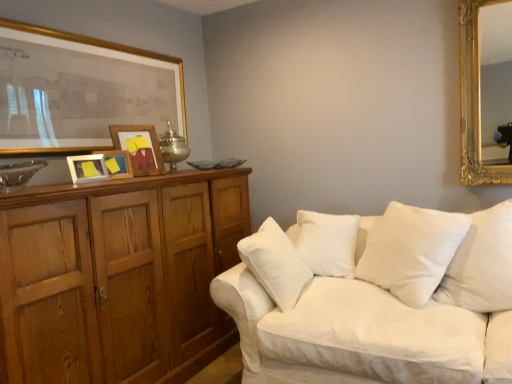
Question: From a real-world perspective, relative to wooden picture frame at left, placed as the 2th picture frame when sorted from back to front, is white soft cushion at center, the 2th pillow positioned from the right, vertically above or below?

Choices:
 (A) above
 (B) below

Answer: (B)

Question: Looking at the image, does white soft cushion at center, the 2th pillow positioned from the right, seem bigger or smaller compared to wooden picture frame at left, placed as the 2th picture frame when sorted from back to front?

Choices:
 (A) small
 (B) big

Answer: (B)

Question: Which object is positioned closest to the white soft cushion at center, which is the 1th pillow in right-to-left order?

Choices:
 (A) matte white picture frame at upper left, acting as the 3th picture frame starting from the back
 (B) wooden cabinet at left
 (C) white fabric couch at lower right
 (D) wooden picture frame at left, placed as the fourth picture frame when sorted from front to back
 (E) gold-framed picture at upper left, the fourth picture frame positioned from the back

Answer: (C)

Question: Estimate the real-world distances between objects in this image. Which object is closer to the white fabric couch at lower right?

Choices:
 (A) wooden cabinet at left
 (B) white soft cushion at center, marked as the second pillow in a left-to-right arrangement
 (C) wooden picture frame at left, placed as the fourth picture frame when sorted from front to back
 (D) matte white picture frame at upper left, acting as the 3th picture frame starting from the back
 (E) wooden picture frame at left, the third picture frame in the front-to-back sequence

Answer: (B)